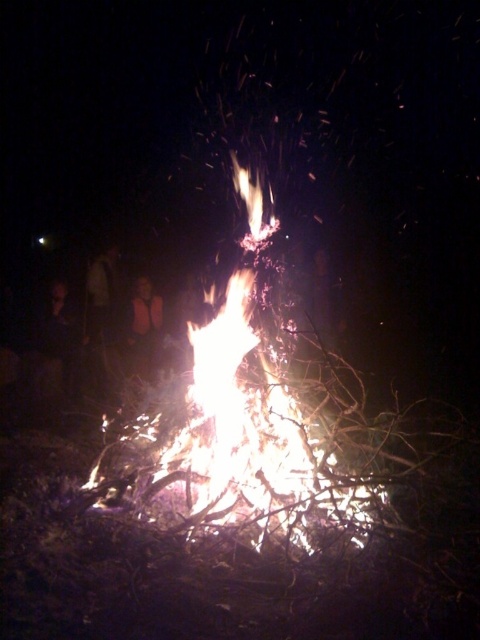
Question: Which of these objects is positioned farthest from the dark fabric shirt at left?

Choices:
 (A) orange vest at center
 (B) bright orange flames at center

Answer: (B)

Question: Is bright orange flames at center to the left of orange vest at center from the viewer's perspective?

Choices:
 (A) yes
 (B) no

Answer: (B)

Question: Does bright orange flames at center have a smaller size compared to orange vest at center?

Choices:
 (A) no
 (B) yes

Answer: (A)

Question: Which of the following is the closest to the observer?

Choices:
 (A) (140, 308)
 (B) (242, 465)

Answer: (B)

Question: Can you confirm if bright orange flames at center is positioned below orange vest at center?

Choices:
 (A) no
 (B) yes

Answer: (B)

Question: Considering the real-world distances, which object is closest to the bright orange flames at center?

Choices:
 (A) orange vest at center
 (B) dark fabric shirt at left

Answer: (A)